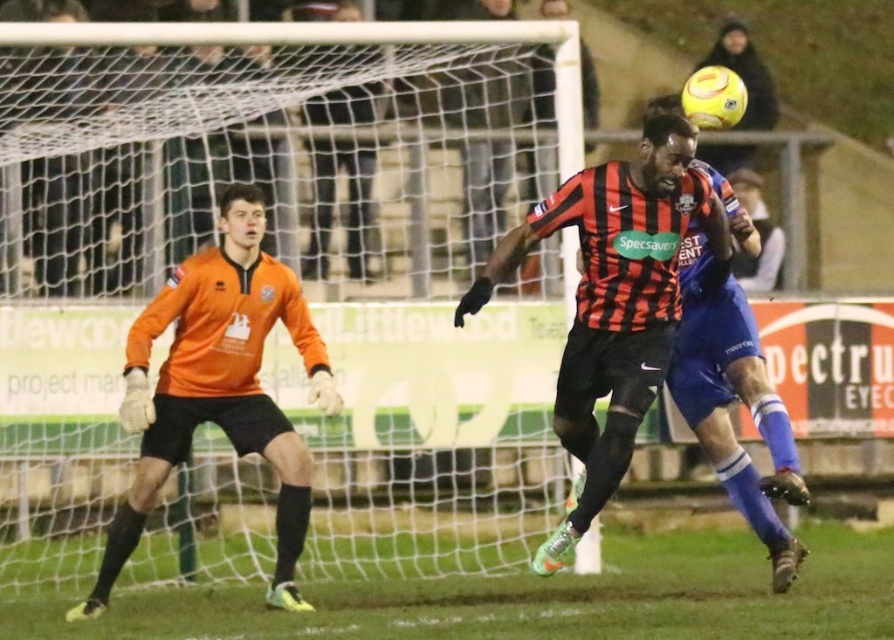
You are a soccer player positioned at the center of the field. You see the matte orange goalkeeper jersey at left represented by point (285, 276). Can you kick the ball past the goalkeeper without it hitting the net behind him?

The matte orange goalkeeper jersey at left is represented by point (285, 276). Since the goalkeeper is positioned at that coordinate, you can aim your shot towards the opposite side of the goal to avoid hitting the net behind him.

You are a soccer referee positioned at the center of the field. You need to quickly assess the positions of the players to make a decision. Which player is closer to you, the matte orange goalkeeper jersey at left or the red and black striped jersey at center?

The matte orange goalkeeper jersey at left is closer to you since it is further to the viewer compared to the red and black striped jersey at center, meaning it is nearer in your perspective.

You are a soccer player positioned at point A, which is at coordinates point (x=0, y=272), and you need to pass the ball to your teammate at point B, located at point (x=332, y=387). Considering the positions of both points, which direction should you kick the ball to ensure it reaches your teammate?

You should kick the ball towards point (x=332, y=387), which is behind point (x=0, y=272) from your current position. Since point (x=0, y=272) is closer to the camera than point (x=332, y=387), you need to aim the ball in the direction away from you towards the teammate at point (x=332, y=387).